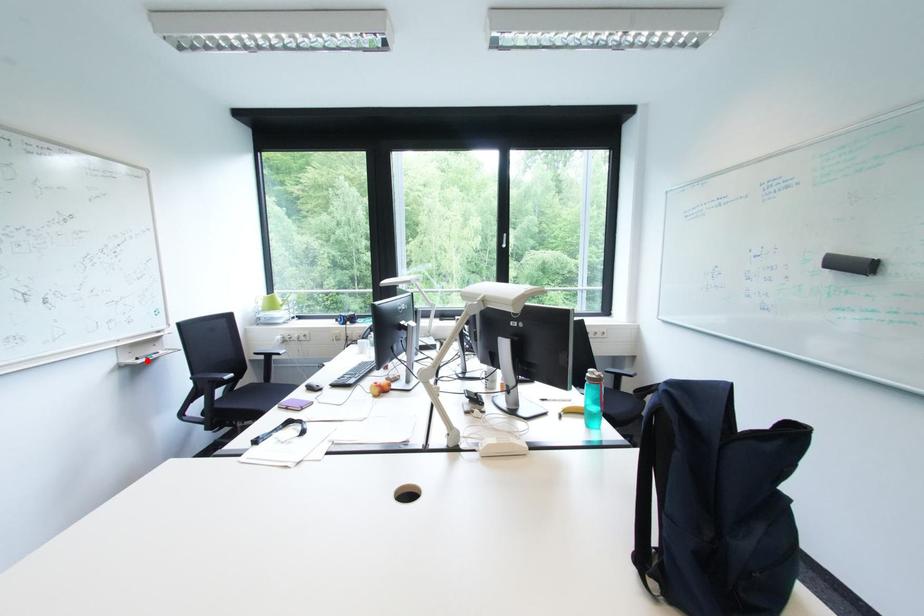
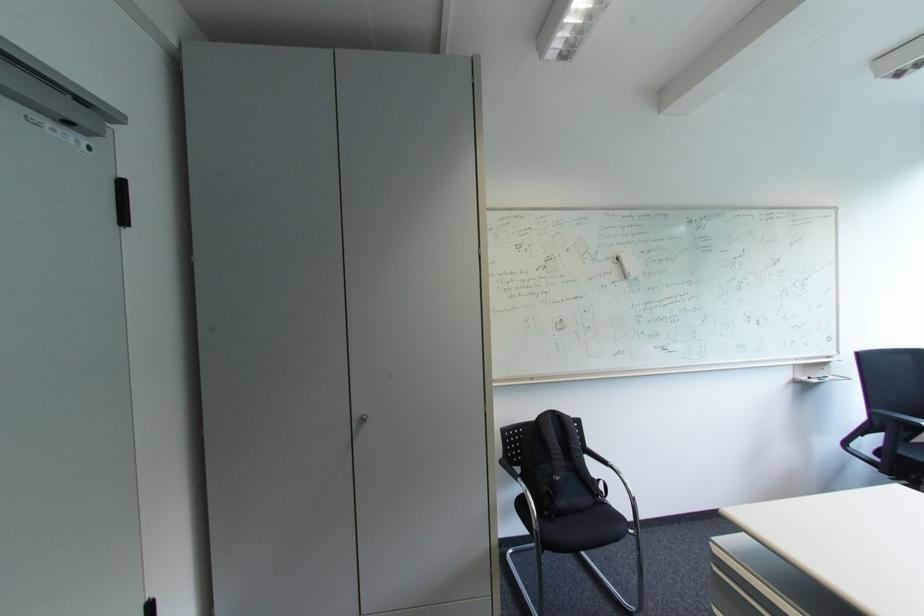
Question: I am providing you with two images of the same scene from different viewpoints. Given a red point in image1, look at the same physical point in image2. Is it:

Choices:
 (A) Closer to the viewpoint
 (B) Farther from the viewpoint

Answer: (A)